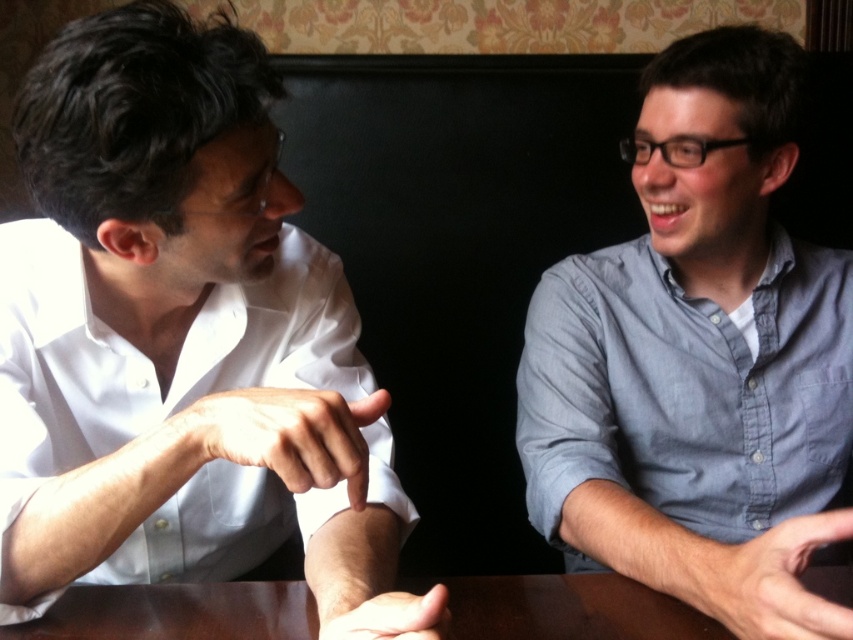
Does white glossy shirt at left appear on the left side of brown wooden table at center?

Yes, white glossy shirt at left is to the left of brown wooden table at center.

Does white glossy shirt at left have a greater width compared to brown wooden table at center?

No.

The image size is (853, 640). Describe the element at coordinates (173, 330) in the screenshot. I see `white glossy shirt at left` at that location.

The width and height of the screenshot is (853, 640). I want to click on white glossy shirt at left, so click(173, 330).

Can you confirm if white glossy shirt at left is shorter than smooth skin hand at lower center?

No.

Between point (33, 465) and point (405, 625), which one is positioned behind?

The point (33, 465) is more distant.

At what (x,y) coordinates should I click in order to perform the action: click on white glossy shirt at left. Please return your answer as a coordinate pair (x, y). Looking at the image, I should click on (173, 330).

Is point (543, 580) less distant than point (265, 397)?

No.

Is point (276, 616) less distant than point (236, 396)?

No, (276, 616) is behind (236, 396).

The height and width of the screenshot is (640, 853). Identify the location of brown wooden table at center. (566, 609).